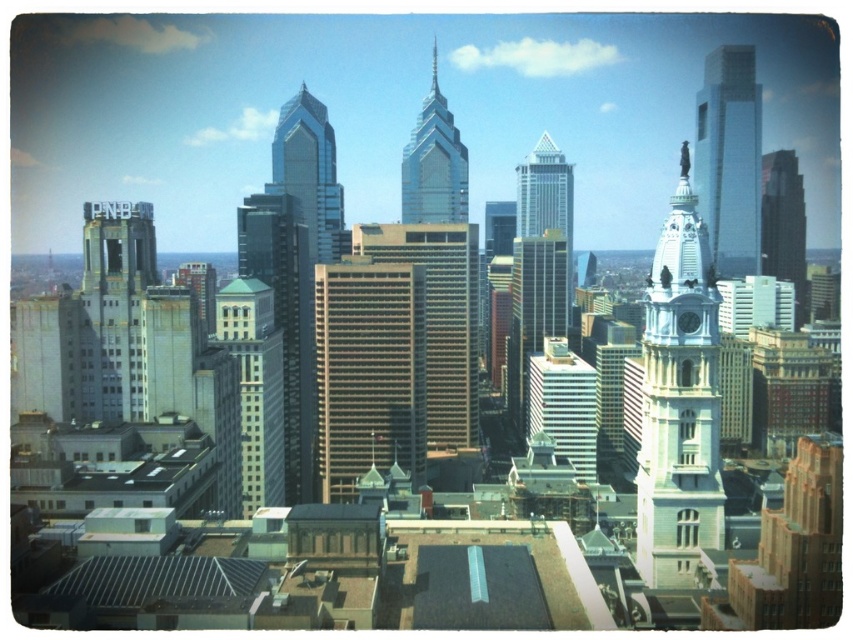
Question: Which point is closer to the camera?

Choices:
 (A) light gray stone building at center-left
 (B) shiny glass skyscraper at center-right
 (C) glassy reflective skyscraper at upper right
 (D) glassy reflective skyscraper at center

Answer: (C)

Question: Which of the following is the farthest from the observer?

Choices:
 (A) glassy silver skyscraper at center
 (B) gray glass skyscraper at center
 (C) white stone clock tower at center

Answer: (A)

Question: In this image, where is glassy reflective skyscraper at upper right located relative to glassy silver skyscraper at center?

Choices:
 (A) left
 (B) right

Answer: (B)

Question: Can you confirm if gold reflective skyscraper at center is positioned below silver glass skyscraper at center?

Choices:
 (A) no
 (B) yes

Answer: (B)

Question: Estimate the real-world distances between objects in this image. Which object is closer to the glassy reflective skyscraper at upper right?

Choices:
 (A) gray glass skyscraper at center
 (B) white stone clock tower at center
 (C) shiny glass skyscraper at center-right

Answer: (C)

Question: Is light gray stone building at center-left further to the viewer compared to shiny silver spire at center?

Choices:
 (A) yes
 (B) no

Answer: (B)